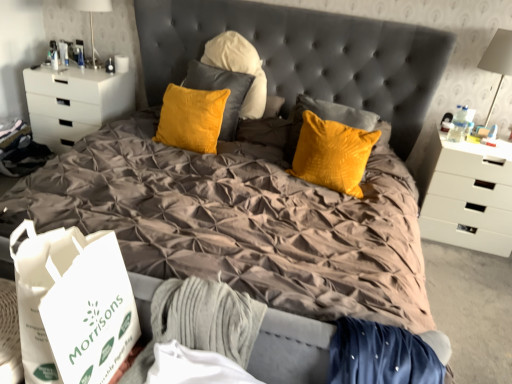
The image size is (512, 384). Describe the element at coordinates (91, 15) in the screenshot. I see `white glossy table lamp at upper left, which appears as the 2th table lamp when viewed from the right` at that location.

Measure the distance between white plastic table lamp at upper right, the 1th table lamp positioned from the bottom, and camera.

They are 2.57 meters apart.

Find the location of a particular element. This screenshot has height=384, width=512. white plastic table lamp at upper right, the 2th table lamp viewed from the back is located at coordinates (x=497, y=60).

Describe the element at coordinates (72, 305) in the screenshot. I see `white paper bag at lower left` at that location.

Find the location of `white glossy table lamp at upper left, arranged as the first table lamp when viewed from the left`. white glossy table lamp at upper left, arranged as the first table lamp when viewed from the left is located at coordinates (91, 15).

Does point (41, 127) come behind point (99, 1)?

Yes, it is.

In the scene shown: Considering the sizes of white matte chest of drawers at left, positioned as the first chest of drawers in left-to-right order, and white glossy table lamp at upper left, which appears as the 2th table lamp when viewed from the right, in the image, is white matte chest of drawers at left, positioned as the first chest of drawers in left-to-right order, wider or thinner than white glossy table lamp at upper left, which appears as the 2th table lamp when viewed from the right,?

Considering their sizes, white matte chest of drawers at left, positioned as the first chest of drawers in left-to-right order, looks broader than white glossy table lamp at upper left, which appears as the 2th table lamp when viewed from the right.

Does white matte chest of drawers at left, placed as the 2th chest of drawers when sorted from right to left, contain white glossy table lamp at upper left, the 2th table lamp viewed from the front?

No, white glossy table lamp at upper left, the 2th table lamp viewed from the front, is not inside white matte chest of drawers at left, placed as the 2th chest of drawers when sorted from right to left.

In the image, is white matte chest of drawers at left, positioned as the first chest of drawers in left-to-right order, positioned in front of or behind white glossy table lamp at upper left, arranged as the first table lamp when viewed from the left?

Visually, white matte chest of drawers at left, positioned as the first chest of drawers in left-to-right order, is located behind white glossy table lamp at upper left, arranged as the first table lamp when viewed from the left.

Is white glossy table lamp at upper left, which is the 2th table lamp from bottom to top, beside white matte chest of drawers at left, positioned as the first chest of drawers in left-to-right order?

No, white glossy table lamp at upper left, which is the 2th table lamp from bottom to top, is not touching white matte chest of drawers at left, positioned as the first chest of drawers in left-to-right order.

Which point is more forward, (72,2) or (97,89)?

Positioned in front is point (72,2).

Identify the location of table lamp that is the 1st object to the right of the white matte chest of drawers at left, positioned as the first chest of drawers in left-to-right order, starting at the anchor. The width and height of the screenshot is (512, 384). (91, 15).

From the image's perspective, is white glossy table lamp at upper left, which is the 2th table lamp from bottom to top, above white matte chest of drawers at left, positioned as the first chest of drawers in left-to-right order?

Correct, white glossy table lamp at upper left, which is the 2th table lamp from bottom to top, appears higher than white matte chest of drawers at left, positioned as the first chest of drawers in left-to-right order, in the image.

Between point (489, 214) and point (80, 343), which one is positioned in front?

Point (80, 343)

From a real-world perspective, which chest of drawers is the 2nd one underneath the white paper bag at lower left? Please provide its 2D coordinates.

[(467, 195)]

In terms of size, does white matte chest of drawers at right, the first chest of drawers viewed from the right, appear bigger or smaller than white paper bag at lower left?

Clearly, white matte chest of drawers at right, the first chest of drawers viewed from the right, is larger in size than white paper bag at lower left.

From the image's perspective, is white matte chest of drawers at right, the first chest of drawers viewed from the right, above white paper bag at lower left?

Yes, from the image's perspective, white matte chest of drawers at right, the first chest of drawers viewed from the right, is on top of white paper bag at lower left.

Which of these two, white glossy table lamp at upper left, the first table lamp from the back, or white matte chest of drawers at right, the first chest of drawers viewed from the right, is thinner?

With smaller width is white glossy table lamp at upper left, the first table lamp from the back.

Which object is positioned more to the right, white glossy table lamp at upper left, arranged as the first table lamp when viewed from the left, or white matte chest of drawers at right, the 2th chest of drawers when ordered from left to right?

Positioned to the right is white matte chest of drawers at right, the 2th chest of drawers when ordered from left to right.

Considering the relative sizes of white glossy table lamp at upper left, the 2th table lamp viewed from the front, and white matte chest of drawers at right, the first chest of drawers viewed from the right, in the image provided, is white glossy table lamp at upper left, the 2th table lamp viewed from the front, bigger than white matte chest of drawers at right, the first chest of drawers viewed from the right,?

Actually, white glossy table lamp at upper left, the 2th table lamp viewed from the front, might be smaller than white matte chest of drawers at right, the first chest of drawers viewed from the right.

Could white matte chest of drawers at right, the first chest of drawers viewed from the right, be considered to be inside white glossy table lamp at upper left, arranged as the first table lamp when viewed from the left?

Definitely not — white matte chest of drawers at right, the first chest of drawers viewed from the right, is not inside white glossy table lamp at upper left, arranged as the first table lamp when viewed from the left.

From their relative heights in the image, would you say white glossy table lamp at upper left, which appears as the 2th table lamp when viewed from the right, is taller or shorter than white paper bag at lower left?

white glossy table lamp at upper left, which appears as the 2th table lamp when viewed from the right, is taller than white paper bag at lower left.

Can you tell me how much white glossy table lamp at upper left, the 2th table lamp viewed from the front, and white paper bag at lower left differ in facing direction?

2.7 degrees.

Relative to white paper bag at lower left, is white glossy table lamp at upper left, the 2th table lamp viewed from the front, in front or behind?

In the image, white glossy table lamp at upper left, the 2th table lamp viewed from the front, appears behind white paper bag at lower left.

Which is correct: white glossy table lamp at upper left, arranged as the first table lamp when viewed from the left, is inside white paper bag at lower left, or outside of it?

white glossy table lamp at upper left, arranged as the first table lamp when viewed from the left, is not enclosed by white paper bag at lower left.

Which is more to the left, white matte chest of drawers at right, the first chest of drawers viewed from the right, or white glossy table lamp at upper left, which appears as the 2th table lamp when viewed from the right?

From the viewer's perspective, white glossy table lamp at upper left, which appears as the 2th table lamp when viewed from the right, appears more on the left side.

Is white matte chest of drawers at right, the first chest of drawers viewed from the right, oriented away from white glossy table lamp at upper left, the first table lamp from the back?

No, white matte chest of drawers at right, the first chest of drawers viewed from the right,'s orientation is not away from white glossy table lamp at upper left, the first table lamp from the back.

Measure the distance from white matte chest of drawers at right, the 2th chest of drawers when ordered from left to right, to white glossy table lamp at upper left, which is the first table lamp in top-to-bottom order.

They are 9.00 feet apart.

Between white matte chest of drawers at right, the 2th chest of drawers when ordered from left to right, and white glossy table lamp at upper left, the 2th table lamp viewed from the front, which one has smaller width?

With smaller width is white glossy table lamp at upper left, the 2th table lamp viewed from the front.

Is white plastic table lamp at upper right, the second table lamp in the top-to-bottom sequence, oriented towards white paper bag at lower left?

No, white plastic table lamp at upper right, the second table lamp in the top-to-bottom sequence, does not turn towards white paper bag at lower left.

Considering the points (494, 65) and (36, 301), which point is behind, point (494, 65) or point (36, 301)?

The point (494, 65) is farther.

Based on the photo, in the image, is white plastic table lamp at upper right, marked as the 2th table lamp in a left-to-right arrangement, on the left side or the right side of white paper bag at lower left?

white plastic table lamp at upper right, marked as the 2th table lamp in a left-to-right arrangement, is positioned on white paper bag at lower left's right side.

Who is shorter, white plastic table lamp at upper right, the 1th table lamp positioned from the bottom, or white paper bag at lower left?

white paper bag at lower left is shorter.

The width and height of the screenshot is (512, 384). There is a white glossy table lamp at upper left, which appears as the 2th table lamp when viewed from the right. Identify the location of the 1st chest of drawers below it (from the image's perspective). (75, 103).

This screenshot has width=512, height=384. What are the coordinates of `chest of drawers on the left of white glossy table lamp at upper left, which is the 2th table lamp from bottom to top` in the screenshot? It's located at (75, 103).

Looking at the image, which one is located further to white plastic table lamp at upper right, the 2th table lamp viewed from the back, white paper bag at lower left or white glossy table lamp at upper left, the first table lamp from the back?

The object further to white plastic table lamp at upper right, the 2th table lamp viewed from the back, is white paper bag at lower left.

When comparing their distances from white paper bag at lower left, does white matte chest of drawers at left, positioned as the first chest of drawers in left-to-right order, or white plastic table lamp at upper right, marked as the 2th table lamp in a left-to-right arrangement, seem further?

Among the two, white plastic table lamp at upper right, marked as the 2th table lamp in a left-to-right arrangement, is located further to white paper bag at lower left.

From the image, which object appears to be farther from white glossy table lamp at upper left, the 2th table lamp viewed from the front, white paper bag at lower left or white plastic table lamp at upper right, the 2th table lamp viewed from the back?

white plastic table lamp at upper right, the 2th table lamp viewed from the back, is positioned further to the anchor white glossy table lamp at upper left, the 2th table lamp viewed from the front.

Considering their positions, is white glossy table lamp at upper left, the 2th table lamp viewed from the front, positioned closer to white paper bag at lower left than white matte chest of drawers at right, the first chest of drawers viewed from the right?

white matte chest of drawers at right, the first chest of drawers viewed from the right, is positioned closer to the anchor white paper bag at lower left.

Considering their positions, is white plastic table lamp at upper right, the 1th table lamp positioned from the bottom, positioned closer to white paper bag at lower left than white matte chest of drawers at left, positioned as the first chest of drawers in left-to-right order?

Based on the image, white matte chest of drawers at left, positioned as the first chest of drawers in left-to-right order, appears to be nearer to white paper bag at lower left.

Considering their positions, is white matte chest of drawers at right, the first chest of drawers viewed from the right, positioned further to white matte chest of drawers at left, positioned as the first chest of drawers in left-to-right order, than white plastic table lamp at upper right, the 1th table lamp positioned from the bottom?

white plastic table lamp at upper right, the 1th table lamp positioned from the bottom, is further to white matte chest of drawers at left, positioned as the first chest of drawers in left-to-right order.

Considering their positions, is white glossy table lamp at upper left, the first table lamp from the back, positioned closer to white plastic table lamp at upper right, the 1th table lamp positioned from the bottom, than white matte chest of drawers at left, positioned as the first chest of drawers in left-to-right order?

white glossy table lamp at upper left, the first table lamp from the back, lies closer to white plastic table lamp at upper right, the 1th table lamp positioned from the bottom, than the other object.

When comparing their distances from white plastic table lamp at upper right, which is counted as the first table lamp, starting from the front, does white matte chest of drawers at left, positioned as the first chest of drawers in left-to-right order, or white matte chest of drawers at right, the 2th chest of drawers when ordered from left to right, seem further?

white matte chest of drawers at left, positioned as the first chest of drawers in left-to-right order, is positioned further to the anchor white plastic table lamp at upper right, which is counted as the first table lamp, starting from the front.

The image size is (512, 384). I want to click on shopping bag between white glossy table lamp at upper left, which appears as the 2th table lamp when viewed from the right, and white plastic table lamp at upper right, the 1th table lamp when ordered from right to left, in the horizontal direction, so click(72, 305).

Identify the location of the chest of drawers situated between white paper bag at lower left and white plastic table lamp at upper right, the 1th table lamp positioned from the bottom, from left to right. This screenshot has width=512, height=384. (467, 195).

Identify the location of table lamp situated between white matte chest of drawers at left, placed as the 2th chest of drawers when sorted from right to left, and white plastic table lamp at upper right, the 1th table lamp when ordered from right to left, from left to right. (91, 15).

Image resolution: width=512 pixels, height=384 pixels. I want to click on the chest of drawers located between white matte chest of drawers at left, positioned as the first chest of drawers in left-to-right order, and white plastic table lamp at upper right, the 1th table lamp positioned from the bottom, in the left-right direction, so click(467, 195).